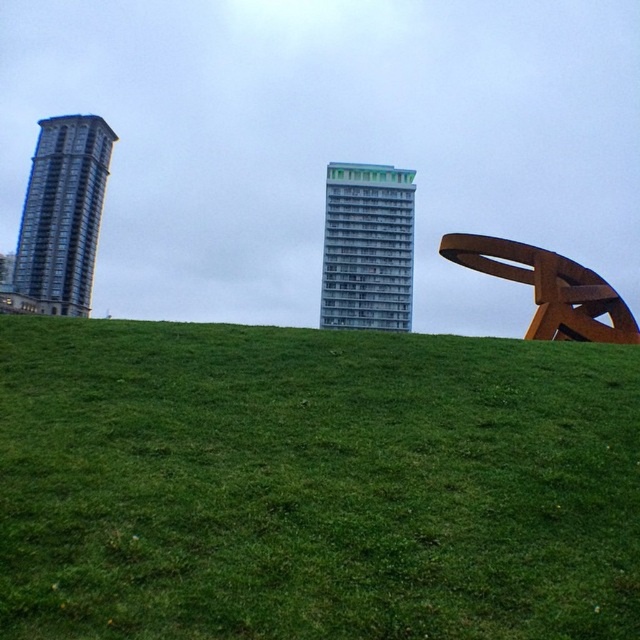
Question: Does glassy reflective building at left appear under rusty metal sculpture at right?

Choices:
 (A) no
 (B) yes

Answer: (A)

Question: Does green grassy at center appear under glassy reflective building at left?

Choices:
 (A) yes
 (B) no

Answer: (A)

Question: Does green grassy at center appear over green glass building at center?

Choices:
 (A) yes
 (B) no

Answer: (B)

Question: Which object is farther from the camera taking this photo?

Choices:
 (A) glassy reflective building at left
 (B) green glass building at center

Answer: (B)

Question: Among these objects, which one is nearest to the camera?

Choices:
 (A) green grassy at center
 (B) rusty metal sculpture at right
 (C) green glass building at center
 (D) glassy reflective building at left

Answer: (A)

Question: Which of the following is the closest to the observer?

Choices:
 (A) (84, 305)
 (B) (403, 234)
 (C) (179, 492)

Answer: (C)